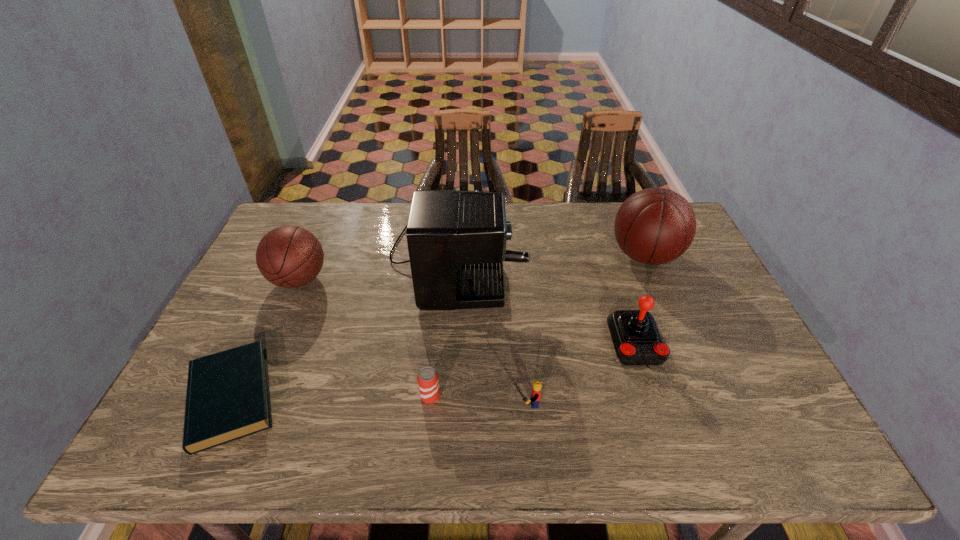
Locate an element on the screen. The height and width of the screenshot is (540, 960). vacant space located 0.070m on the back of the left basketball is located at coordinates (314, 247).

Image resolution: width=960 pixels, height=540 pixels. Find the location of `vacant space situated on the base of the joystick`. vacant space situated on the base of the joystick is located at coordinates (660, 417).

Locate an element on the screen. vacant region located on the front-facing side of the Lego is located at coordinates (385, 403).

Find the location of a particular element. free region located on the front-facing side of the Lego is located at coordinates (406, 403).

Where is `vacant point located 0.200m on the front-facing side of the Lego`? Image resolution: width=960 pixels, height=540 pixels. vacant point located 0.200m on the front-facing side of the Lego is located at coordinates (427, 403).

Identify the location of free space located on the right of the beer can. Image resolution: width=960 pixels, height=540 pixels. (486, 396).

Locate an element on the screen. free region located 0.140m on the back of the shortest object is located at coordinates (272, 310).

The width and height of the screenshot is (960, 540). I want to click on coffee maker located in the far edge section of the desktop, so click(456, 240).

Identify the location of basketball at the far edge. (654, 226).

Identify the location of object present at the near edge. Image resolution: width=960 pixels, height=540 pixels. (228, 398).